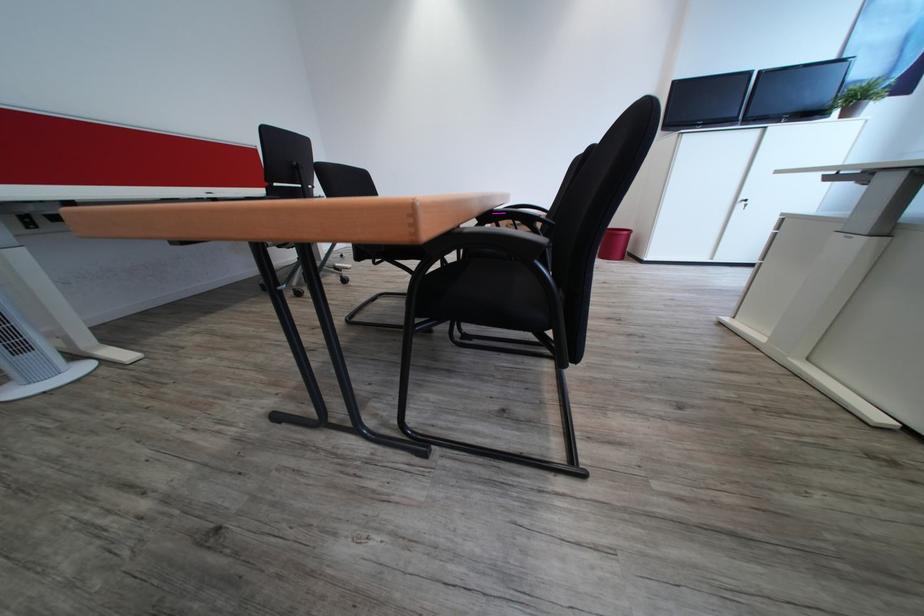
Describe the element at coordinates (743, 203) in the screenshot. The image size is (924, 616). I see `the cabinet door lock` at that location.